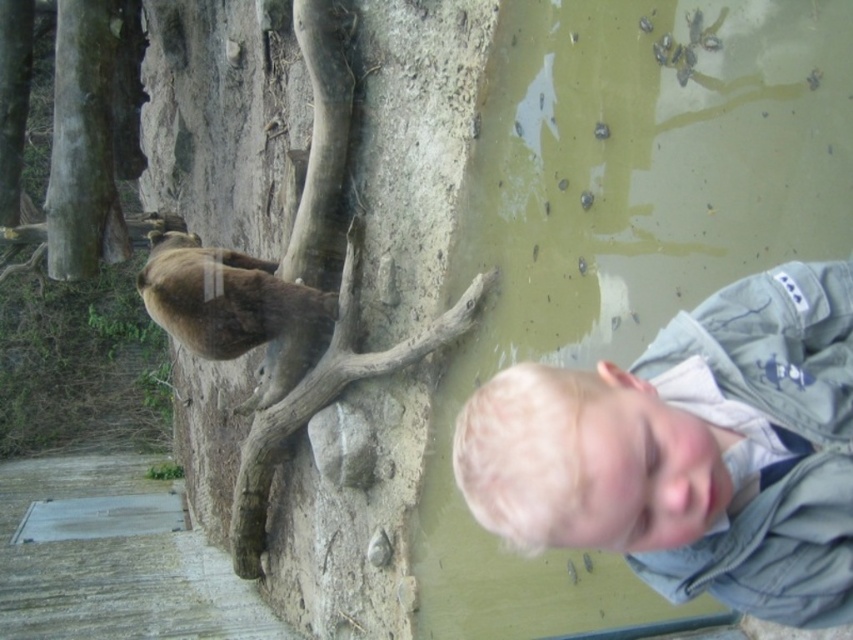
Question: Estimate the real-world distances between objects in this image. Which object is farther from the blonde hair at lower right?

Choices:
 (A) brown furry bear at upper left
 (B) brown rough bark tree at upper left

Answer: (B)

Question: Does blonde hair at lower right appear over brown furry bear at upper left?

Choices:
 (A) yes
 (B) no

Answer: (B)

Question: Does brown rough bark tree at upper left have a greater width compared to blonde hair at lower right?

Choices:
 (A) yes
 (B) no

Answer: (A)

Question: Can you confirm if blonde hair at lower right is wider than brown furry bear at upper left?

Choices:
 (A) yes
 (B) no

Answer: (B)

Question: Which object is the closest to the brown rough bark tree at upper left?

Choices:
 (A) brown furry bear at upper left
 (B) blonde hair at lower right

Answer: (A)

Question: Which object is closer to the camera taking this photo?

Choices:
 (A) blonde hair at lower right
 (B) brown furry bear at upper left
 (C) brown rough bark tree at upper left

Answer: (A)